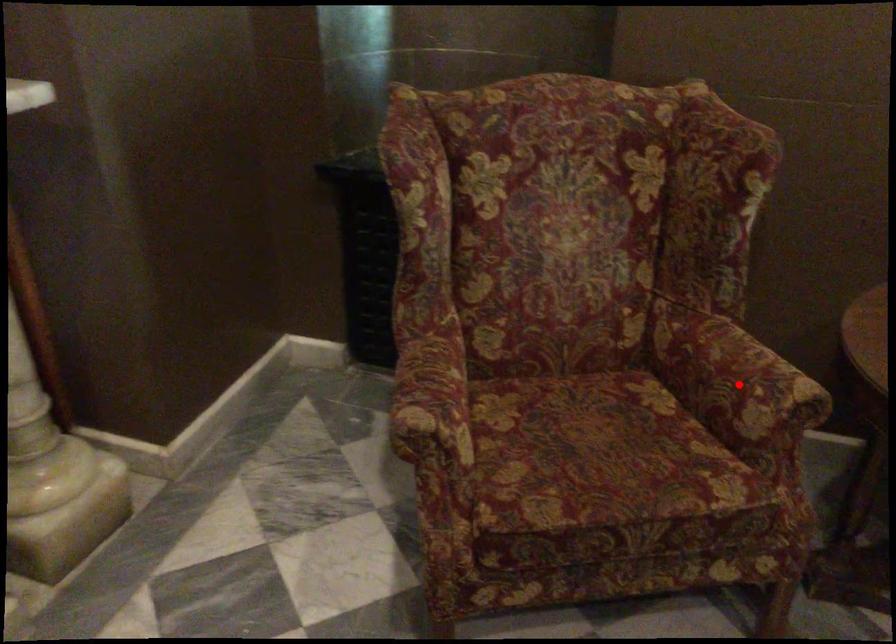
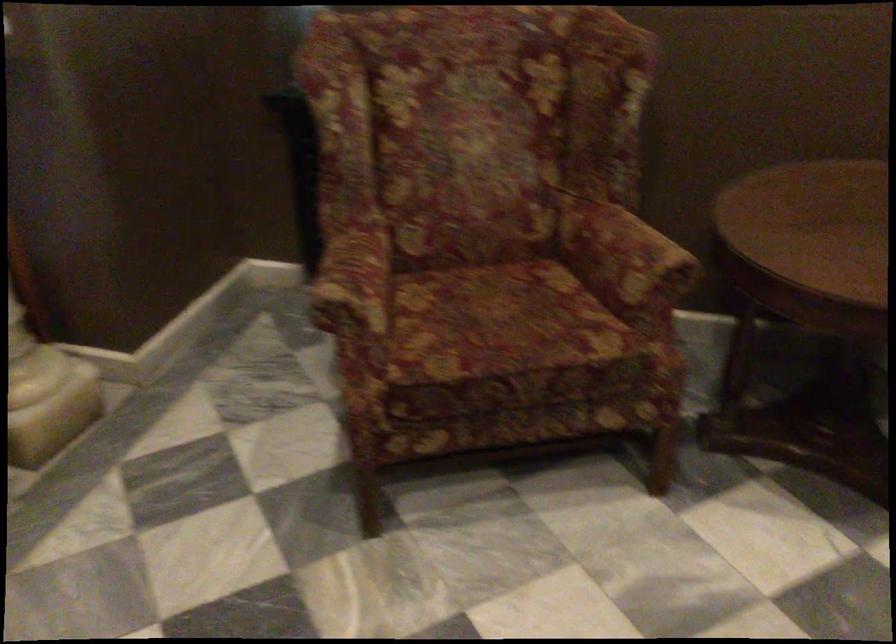
In the second image, find the point that corresponds to the highlighted location in the first image.

(624, 258)